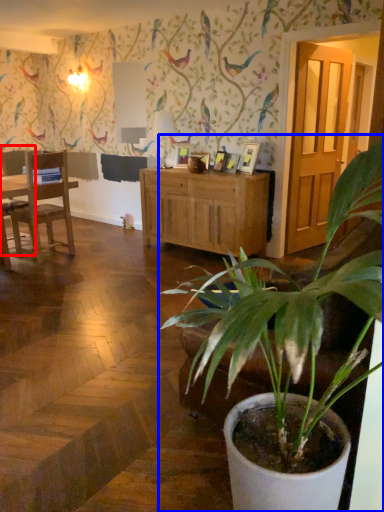
Question: Among these objects, which one is nearest to the camera, chair (highlighted by a red box) or houseplant (highlighted by a blue box)?

Choices:
 (A) chair
 (B) houseplant

Answer: (B)